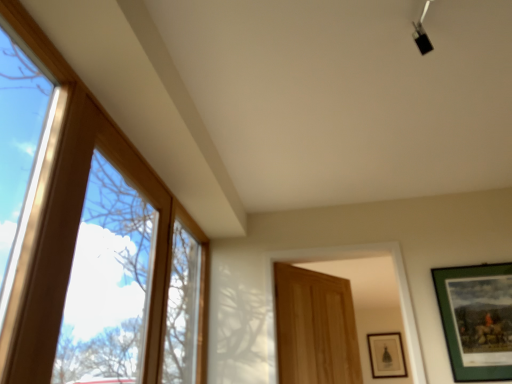
Question: Are green matte picture frame at right, acting as the first picture frame starting from the left, and wooden door at center beside each other?

Choices:
 (A) yes
 (B) no

Answer: (B)

Question: From a real-world perspective, is green matte picture frame at right, which is the 1th picture frame from top to bottom, below wooden door at center?

Choices:
 (A) yes
 (B) no

Answer: (A)

Question: Is green matte picture frame at right, which is the 1th picture frame from top to bottom, to the right of wooden door at center from the viewer's perspective?

Choices:
 (A) yes
 (B) no

Answer: (A)

Question: From a real-world perspective, is green matte picture frame at right, which is the 1th picture frame from top to bottom, on wooden door at center?

Choices:
 (A) no
 (B) yes

Answer: (A)

Question: Is green matte picture frame at right, acting as the first picture frame starting from the left, turned away from wooden door at center?

Choices:
 (A) yes
 (B) no

Answer: (B)

Question: Relative to clear glass window at left, is green matte picture frame at lower right, which appears as the second picture frame when viewed from the front, in front or behind?

Choices:
 (A) front
 (B) behind

Answer: (B)

Question: Does point (376, 362) appear closer or farther from the camera than point (58, 135)?

Choices:
 (A) farther
 (B) closer

Answer: (A)

Question: Is green matte picture frame at lower right, acting as the 2th picture frame starting from the top, situated inside clear glass window at left or outside?

Choices:
 (A) inside
 (B) outside

Answer: (B)

Question: Looking at their shapes, would you say green matte picture frame at lower right, acting as the 2th picture frame starting from the top, is wider or thinner than clear glass window at left?

Choices:
 (A) thin
 (B) wide

Answer: (A)

Question: From a real-world perspective, is wooden door at center positioned above or below green matte picture frame at right, the second picture frame from the back?

Choices:
 (A) above
 (B) below

Answer: (A)

Question: Considering their positions, is wooden door at center located in front of or behind green matte picture frame at right, acting as the first picture frame starting from the left?

Choices:
 (A) front
 (B) behind

Answer: (B)

Question: From the image's perspective, relative to green matte picture frame at right, which is the 1th picture frame from top to bottom, is wooden door at center above or below?

Choices:
 (A) below
 (B) above

Answer: (A)

Question: Is wooden door at center bigger or smaller than green matte picture frame at right, marked as the second picture frame in a right-to-left arrangement?

Choices:
 (A) big
 (B) small

Answer: (A)

Question: From a real-world perspective, is wooden door at center physically located above or below green matte picture frame at lower right, acting as the 2th picture frame starting from the top?

Choices:
 (A) below
 (B) above

Answer: (A)

Question: Considering the positions of point (286, 364) and point (368, 344), is point (286, 364) closer or farther from the camera than point (368, 344)?

Choices:
 (A) farther
 (B) closer

Answer: (B)